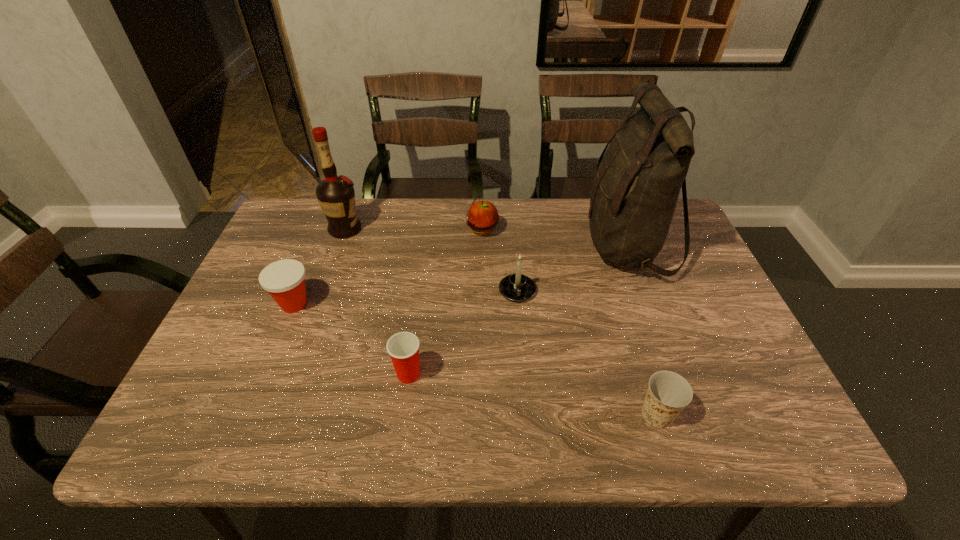
The height and width of the screenshot is (540, 960). What are the coordinates of `free space at the far left corner of the desktop` in the screenshot? It's located at (297, 201).

This screenshot has width=960, height=540. In order to click on unoccupied area between the apple and the sixth farthest object in this screenshot , I will do `click(445, 302)`.

You are a GUI agent. You are given a task and a screenshot of the screen. Output one action in this format:
    pyautogui.click(x=<x>, y=<y>)
    Task: Click on the free point between the candle holder and the apple
    This screenshot has height=540, width=960.
    Given the screenshot: What is the action you would take?
    pyautogui.click(x=500, y=260)

In order to click on free spot between the candle holder and the second farthest Dixie cup in this screenshot , I will do `click(463, 332)`.

At what (x,y) coordinates should I click in order to perform the action: click on vacant space that is in between the second tallest object and the tallest object. Please return your answer as a coordinate pair (x, y). Looking at the image, I should click on (486, 237).

The image size is (960, 540). I want to click on free space between the second Dixie cup from right to left and the apple, so click(445, 302).

This screenshot has height=540, width=960. Find the location of `vacant point located between the nearest Dixie cup and the leftmost Dixie cup`. vacant point located between the nearest Dixie cup and the leftmost Dixie cup is located at coordinates (476, 359).

This screenshot has height=540, width=960. Find the location of `vacant area that lies between the farthest Dixie cup and the nearest object`. vacant area that lies between the farthest Dixie cup and the nearest object is located at coordinates (476, 359).

The image size is (960, 540). What are the coordinates of `vacant area that lies between the liquor and the backpack` in the screenshot? It's located at (486, 237).

Locate an element on the screen. vacant area that lies between the rightmost Dixie cup and the farthest Dixie cup is located at coordinates click(476, 359).